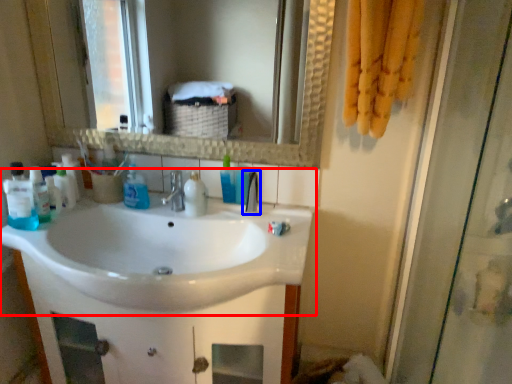
Question: Among these objects, which one is farthest to the camera, sink (highlighted by a red box) or tap (highlighted by a blue box)?

Choices:
 (A) sink
 (B) tap

Answer: (B)